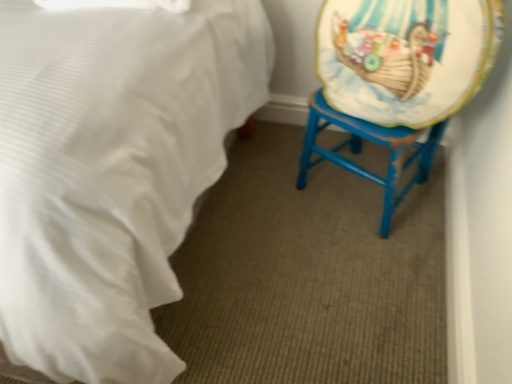
I want to click on vacant position to the left of blue painted wood swivel chair at right, so click(x=268, y=193).